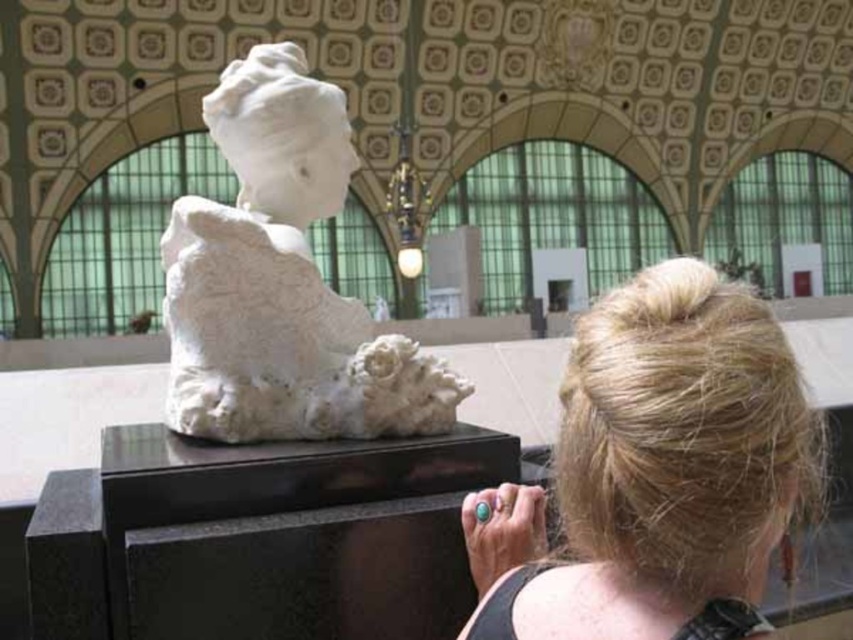
Question: Can you confirm if blonde hair at upper right is positioned to the left of white marble sculpture at center?

Choices:
 (A) no
 (B) yes

Answer: (A)

Question: In this image, where is blonde hair at upper right located relative to white marble sculpture at center?

Choices:
 (A) below
 (B) above

Answer: (A)

Question: Does blonde hair at upper right have a greater width compared to white marble sculpture at center?

Choices:
 (A) no
 (B) yes

Answer: (B)

Question: Which object is closer to the camera taking this photo?

Choices:
 (A) blonde hair at upper right
 (B) white marble sculpture at center

Answer: (A)